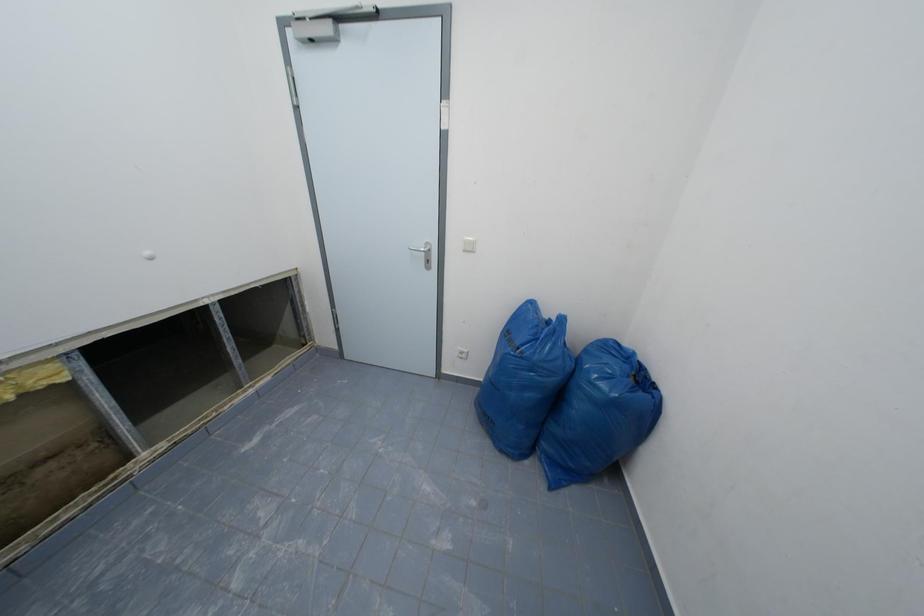
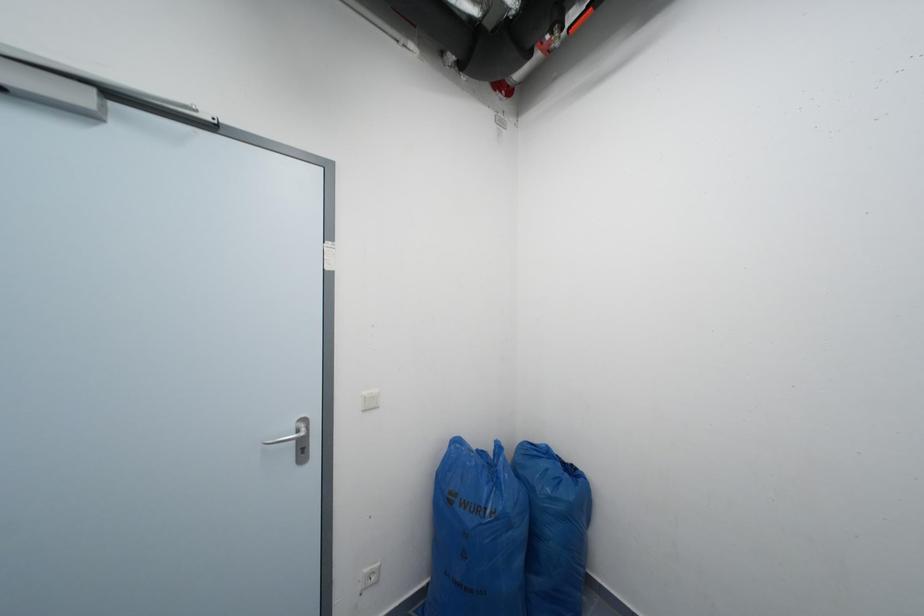
Question: How did the camera likely rotate?

Choices:
 (A) Left
 (B) Right
 (C) Up
 (D) Down

Answer: (B)